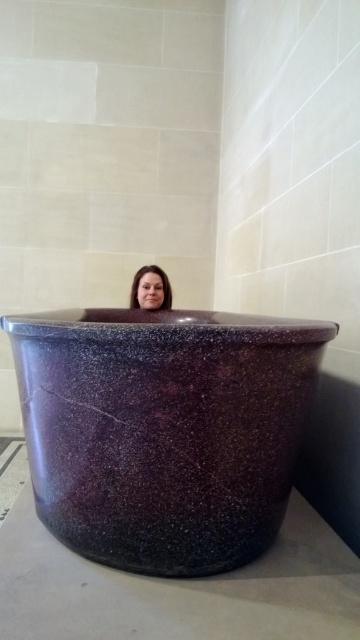
Question: Can you confirm if purple speckled stone at center is wider than matte purple stone woman at center?

Choices:
 (A) yes
 (B) no

Answer: (A)

Question: Does purple speckled stone at center appear over matte purple stone woman at center?

Choices:
 (A) no
 (B) yes

Answer: (A)

Question: From the image, what is the correct spatial relationship of purple speckled stone at center in relation to matte purple stone woman at center?

Choices:
 (A) below
 (B) above

Answer: (A)

Question: Which point is closer to the camera?

Choices:
 (A) matte purple stone woman at center
 (B) purple speckled stone at center

Answer: (B)

Question: Which of the following is the farthest from the observer?

Choices:
 (A) (168, 282)
 (B) (68, 492)

Answer: (A)